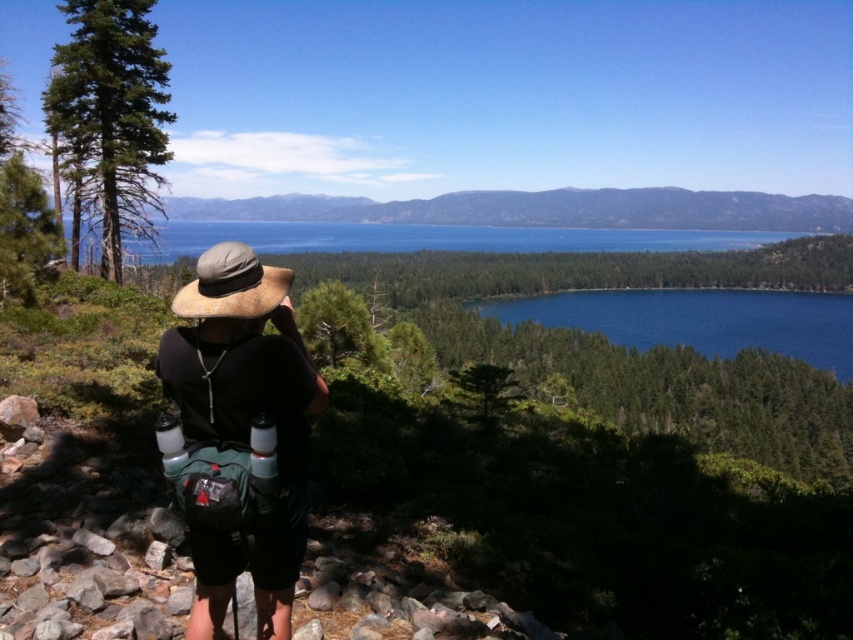
Question: Is dark green backpack at center thinner than blue glassy water at center?

Choices:
 (A) no
 (B) yes

Answer: (B)

Question: Among these objects, which one is farthest from the camera?

Choices:
 (A) dark green backpack at center
 (B) blue water at center
 (C) blue glassy water at center

Answer: (C)

Question: In this image, where is dark green backpack at center located relative to blue glassy water at center?

Choices:
 (A) left
 (B) right

Answer: (A)

Question: Which object is farther from the camera taking this photo?

Choices:
 (A) dark green backpack at center
 (B) blue water at center

Answer: (B)

Question: Estimate the real-world distances between objects in this image. Which object is farther from the blue water at center?

Choices:
 (A) blue glassy water at center
 (B) dark green backpack at center

Answer: (B)

Question: Does blue glassy water at center come in front of blue water at center?

Choices:
 (A) yes
 (B) no

Answer: (B)